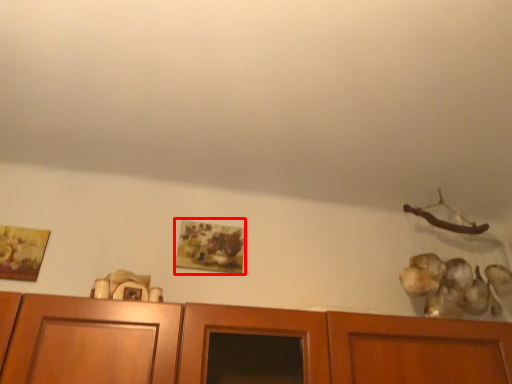
Question: From the image, what is the correct spatial relationship of picture frame (annotated by the red box) in relation to picture frame?

Choices:
 (A) right
 (B) left

Answer: (A)